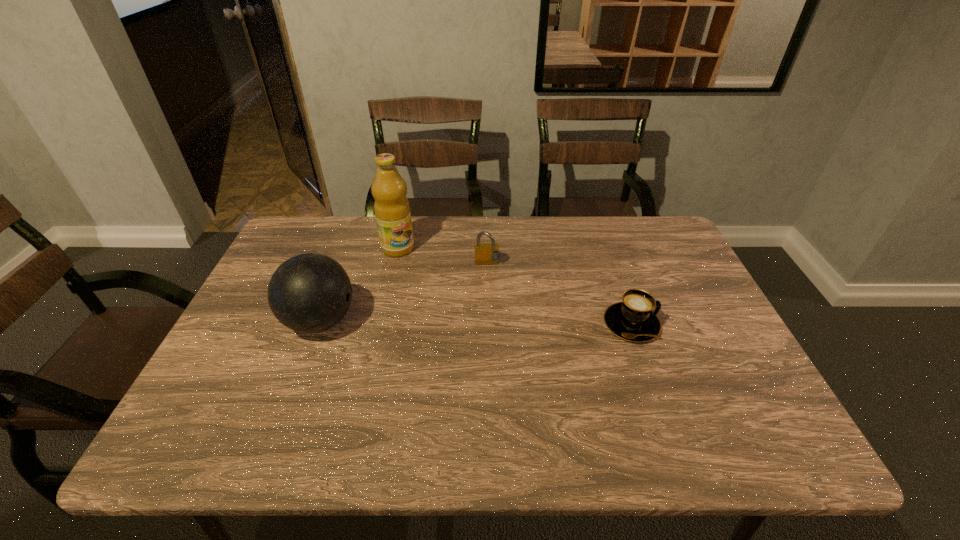
Where is `free space between the tallest object and the bowling ball`? free space between the tallest object and the bowling ball is located at coordinates (359, 285).

Where is `unoccupied area between the tallest object and the padlock`? Image resolution: width=960 pixels, height=540 pixels. unoccupied area between the tallest object and the padlock is located at coordinates (443, 256).

Locate an element on the screen. free space that is in between the olive oil and the shortest object is located at coordinates (515, 286).

Image resolution: width=960 pixels, height=540 pixels. I want to click on free space between the leftmost object and the tallest object, so click(359, 285).

This screenshot has height=540, width=960. I want to click on vacant space in between the cappuccino and the padlock, so click(x=559, y=294).

Locate an element on the screen. This screenshot has width=960, height=540. unoccupied area between the bowling ball and the olive oil is located at coordinates (359, 285).

You are a GUI agent. You are given a task and a screenshot of the screen. Output one action in this format:
    pyautogui.click(x=<x>, y=<y>)
    Task: Click on the free point between the second tallest object and the tallest object
    
    Given the screenshot: What is the action you would take?
    pyautogui.click(x=359, y=285)

Identify the location of object identified as the closest to the rightmost object. (485, 254).

You are a GUI agent. You are given a task and a screenshot of the screen. Output one action in this format:
    pyautogui.click(x=<x>, y=<y>)
    Task: Click on the object that is the third closest to the leftmost object
    
    Given the screenshot: What is the action you would take?
    pyautogui.click(x=633, y=320)